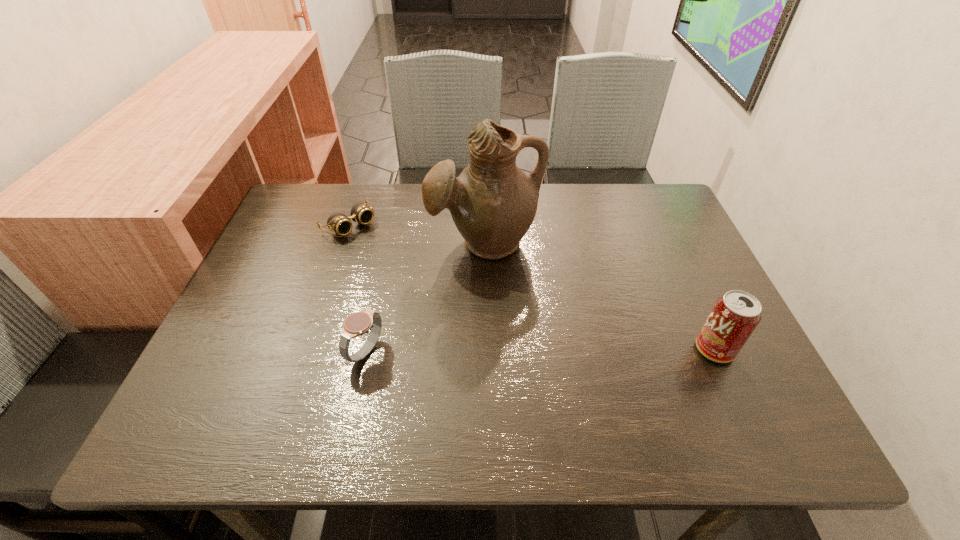
Locate an element on the screen. The image size is (960, 540). vacant area located 0.260m at the spout of the tallest object is located at coordinates (492, 359).

The height and width of the screenshot is (540, 960). Find the location of `free spot located at the spout of the tallest object`. free spot located at the spout of the tallest object is located at coordinates (489, 304).

You are a GUI agent. You are given a task and a screenshot of the screen. Output one action in this format:
    pyautogui.click(x=<x>, y=<y>)
    Task: Click on the vacant area located at the spout of the tallest object
    The image size is (960, 540).
    Given the screenshot: What is the action you would take?
    pyautogui.click(x=492, y=354)

Where is `vacant space located through the lenses of the shortest object`? The image size is (960, 540). vacant space located through the lenses of the shortest object is located at coordinates (376, 247).

Where is `free location located 0.220m through the lenses of the shortest object`? The image size is (960, 540). free location located 0.220m through the lenses of the shortest object is located at coordinates (415, 278).

At what (x,y) coordinates should I click in order to perform the action: click on free space located 0.080m through the lenses of the shortest object. Please return your answer as a coordinate pair (x, y). This screenshot has width=960, height=540. Looking at the image, I should click on (381, 251).

Find the location of a particular element. pitcher that is at the far edge is located at coordinates (493, 203).

Find the location of a particular element. goggles positioned at the far edge is located at coordinates (338, 222).

The height and width of the screenshot is (540, 960). In order to click on watch that is at the near edge in this screenshot , I will do `click(358, 323)`.

The image size is (960, 540). What are the coordinates of `soda can positioned at the near edge` in the screenshot? It's located at (735, 315).